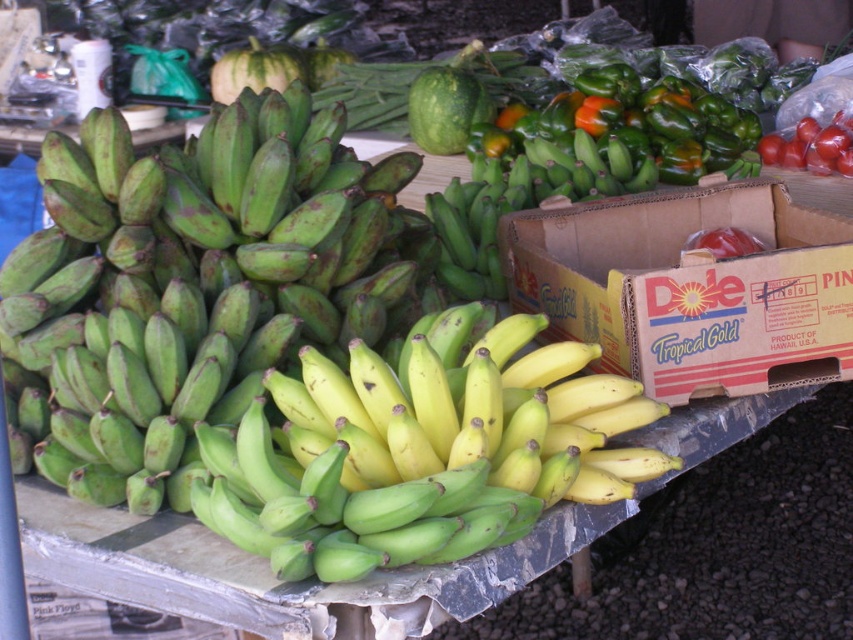
You are a customer at the market stall and want to buy a fruit that is bigger than the other. Which one should you choose between the green matte bananas at center and the red matte tomato at center?

The green matte bananas at center are larger in size than the red matte tomato at center, so you should choose the green matte bananas at center.

In the scene shown: You are a customer at the market stall and want to buy a fruit that is wider than the other. Which one should you choose between the green matte bananas at center and the red matte tomato at center?

The green matte bananas at center are wider than the red matte tomato at center, so you should choose the green matte bananas at center.